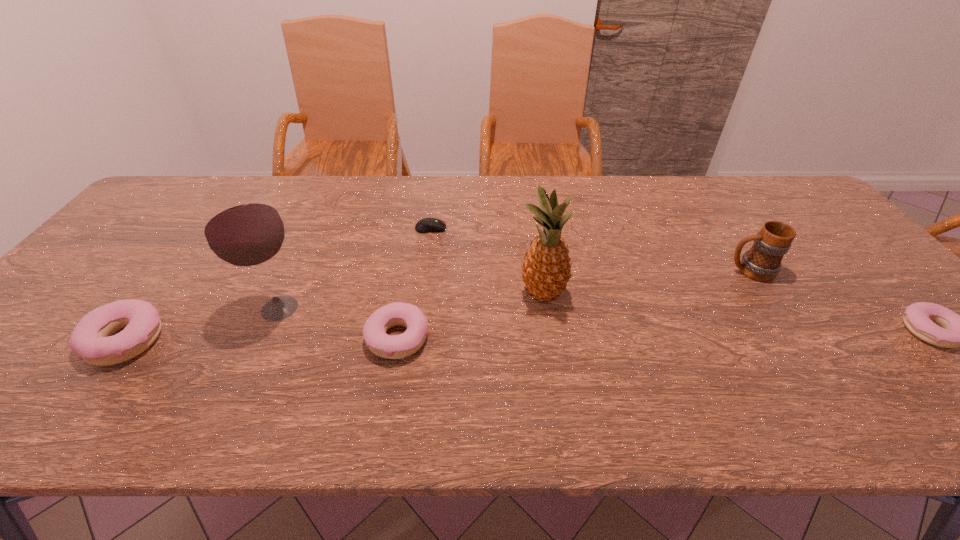
Choose which doughnut is the second nearest neighbor to the third shortest object. Please provide its 2D coordinates. Your answer should be formatted as a tuple, i.e. [(x, y)], where the tuple contains the x and y coordinates of a point satisfying the conditions above.

[(935, 324)]

The image size is (960, 540). Identify the location of vacant region that satisfies the following two spatial constraints: 1. on the button of the shortest object; 2. on the front side of the alcohol. (420, 308).